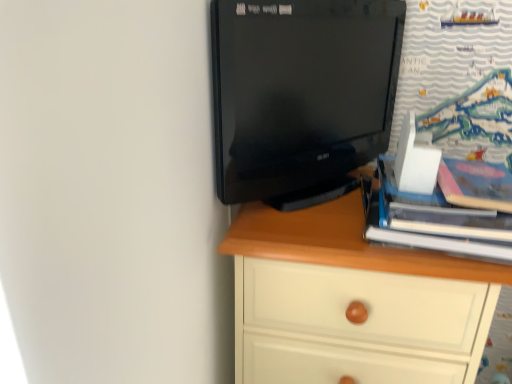
Question: From the image's perspective, is hardcover book at right beneath white wood chest of drawers at center?

Choices:
 (A) no
 (B) yes

Answer: (A)

Question: Does hardcover book at right contain white wood chest of drawers at center?

Choices:
 (A) no
 (B) yes

Answer: (A)

Question: From a real-world perspective, is hardcover book at right on top of white wood chest of drawers at center?

Choices:
 (A) no
 (B) yes

Answer: (B)

Question: From a real-world perspective, is hardcover book at right below white wood chest of drawers at center?

Choices:
 (A) yes
 (B) no

Answer: (B)

Question: Does hardcover book at right have a greater height compared to white wood chest of drawers at center?

Choices:
 (A) no
 (B) yes

Answer: (A)

Question: Is hardcover book at right to the left of white wood chest of drawers at center from the viewer's perspective?

Choices:
 (A) no
 (B) yes

Answer: (A)

Question: From a real-world perspective, does black glossy monitor at upper center stand above white wood chest of drawers at center?

Choices:
 (A) no
 (B) yes

Answer: (B)

Question: Does black glossy monitor at upper center have a lesser width compared to white wood chest of drawers at center?

Choices:
 (A) yes
 (B) no

Answer: (A)

Question: Is the position of black glossy monitor at upper center more distant than that of white wood chest of drawers at center?

Choices:
 (A) yes
 (B) no

Answer: (B)

Question: Considering the relative sizes of black glossy monitor at upper center and white wood chest of drawers at center in the image provided, is black glossy monitor at upper center taller than white wood chest of drawers at center?

Choices:
 (A) yes
 (B) no

Answer: (B)

Question: From the image's perspective, is black glossy monitor at upper center below white wood chest of drawers at center?

Choices:
 (A) yes
 (B) no

Answer: (B)

Question: Can you confirm if black glossy monitor at upper center is positioned to the left of white wood chest of drawers at center?

Choices:
 (A) no
 (B) yes

Answer: (B)

Question: Is hardcover book at right at the back of black glossy monitor at upper center?

Choices:
 (A) yes
 (B) no

Answer: (B)